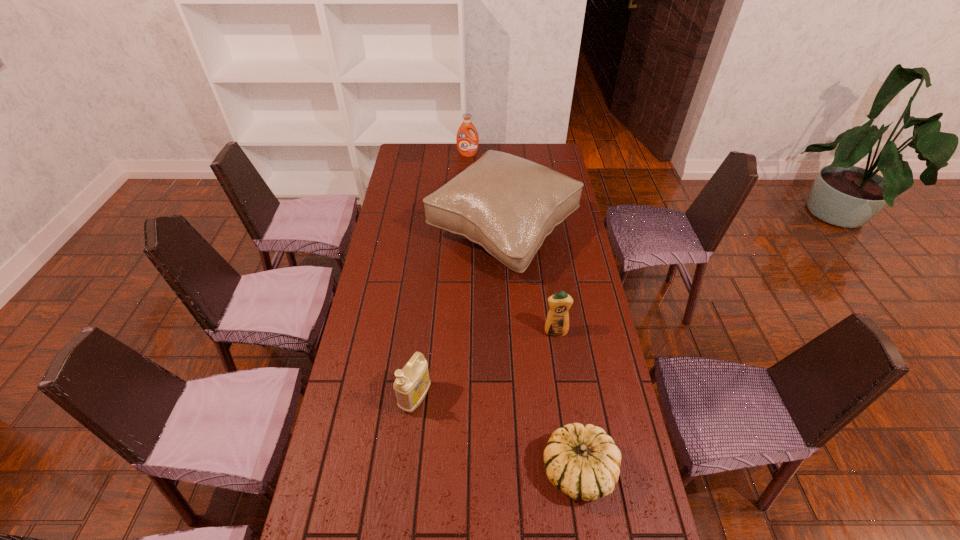
At what (x,y) coordinates should I click in order to perform the action: click on vacant region at the left edge of the desktop. Please return your answer as a coordinate pair (x, y). Image resolution: width=960 pixels, height=540 pixels. Looking at the image, I should click on (390, 303).

Identify the location of vacant space at the right edge of the desktop. coord(564,244).

Where is `vacant space at the far left corner`? The image size is (960, 540). vacant space at the far left corner is located at coordinates (410, 157).

The height and width of the screenshot is (540, 960). What are the coordinates of `empty space between the gourd and the second nearest object` in the screenshot? It's located at (497, 434).

Find the location of a particular element. This screenshot has height=540, width=960. empty location between the third nearest object and the leftmost detergent is located at coordinates (486, 365).

Locate an element on the screen. free space between the second farthest object and the second nearest detergent is located at coordinates (529, 282).

Find the location of a particular element. empty space that is in between the cushion and the gourd is located at coordinates (541, 352).

Identify the location of empty space between the third nearest object and the gourd. The image size is (960, 540). (x=567, y=401).

This screenshot has height=540, width=960. Find the location of `vacant space in between the nearest object and the farthest detergent`. vacant space in between the nearest object and the farthest detergent is located at coordinates (523, 312).

Identify which object is the second nearest to the gourd. Please provide its 2D coordinates. Your answer should be formatted as a tuple, i.e. [(x, y)], where the tuple contains the x and y coordinates of a point satisfying the conditions above.

[(557, 323)]